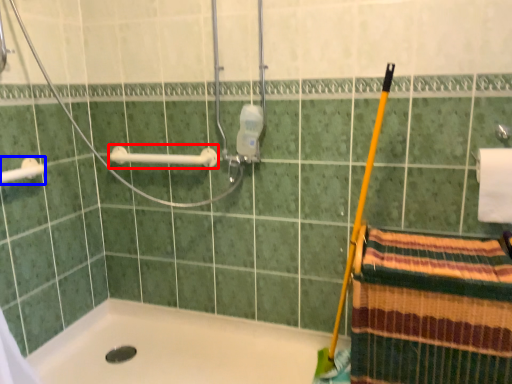
Question: Which object appears closest to the camera in this image, towel bar (highlighted by a red box) or towel bar (highlighted by a blue box)?

Choices:
 (A) towel bar
 (B) towel bar

Answer: (B)